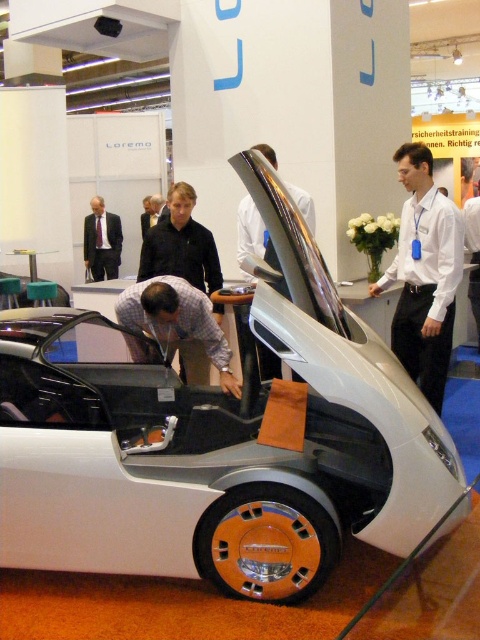
Does white matte car at center have a lesser height compared to white shirt at right?

Incorrect, white matte car at center's height does not fall short of white shirt at right's.

Consider the image. Can you confirm if white matte car at center is wider than white shirt at right?

Yes.

Does point (339, 301) come closer to viewer compared to point (408, 209)?

Yes, it is.

You are a GUI agent. You are given a task and a screenshot of the screen. Output one action in this format:
    pyautogui.click(x=<x>, y=<y>)
    Task: Click on the white matte car at center
    
    Given the screenshot: What is the action you would take?
    pyautogui.click(x=217, y=440)

Is white matte car at center above matte gray car at center?

No.

Is white matte car at center closer to the viewer compared to matte gray car at center?

Yes, it is in front of matte gray car at center.

What are the coordinates of `white matte car at center` in the screenshot? It's located at (217, 440).

Locate an element on the screen. The width and height of the screenshot is (480, 640). white matte car at center is located at coordinates (217, 440).

Is point (165, 317) more distant than point (264, 144)?

No.

Does matte gray car at center appear on the right side of glossy metallic car door at center?

No, matte gray car at center is not to the right of glossy metallic car door at center.

Between point (116, 304) and point (282, 284), which one is positioned behind?

Positioned behind is point (116, 304).

Identify the location of matte gray car at center. The height and width of the screenshot is (640, 480). (177, 321).